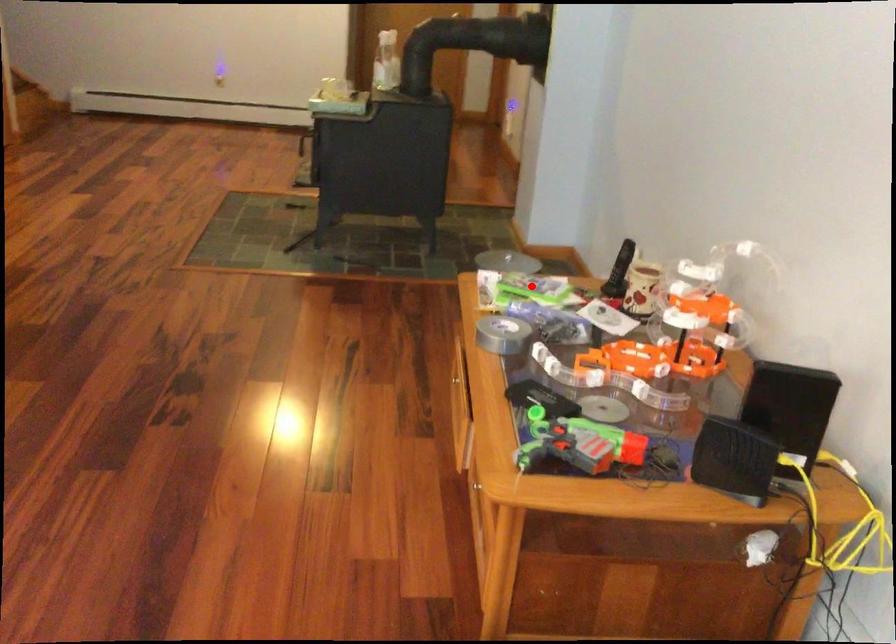
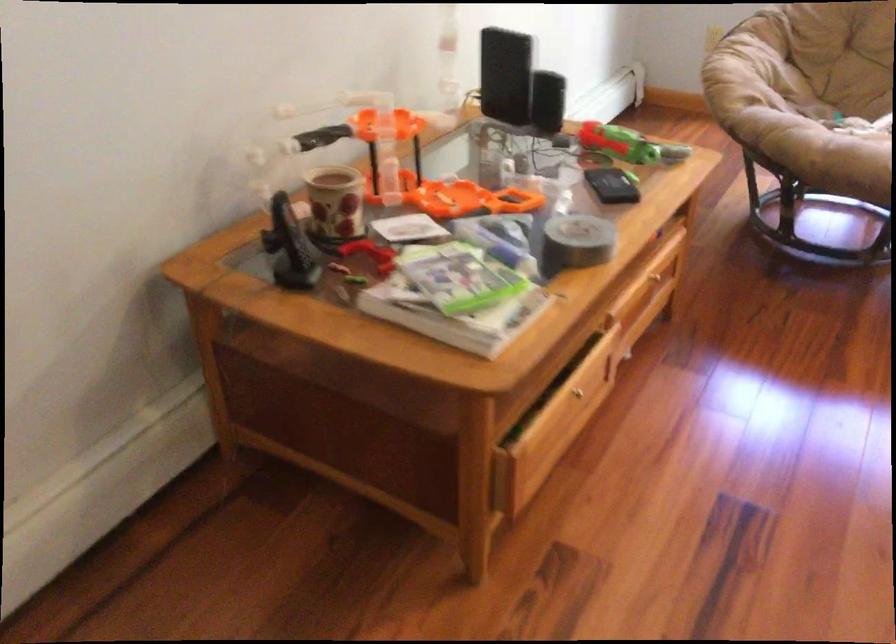
Locate, in the second image, the point that corresponds to the highlighted location in the first image.

(459, 277)